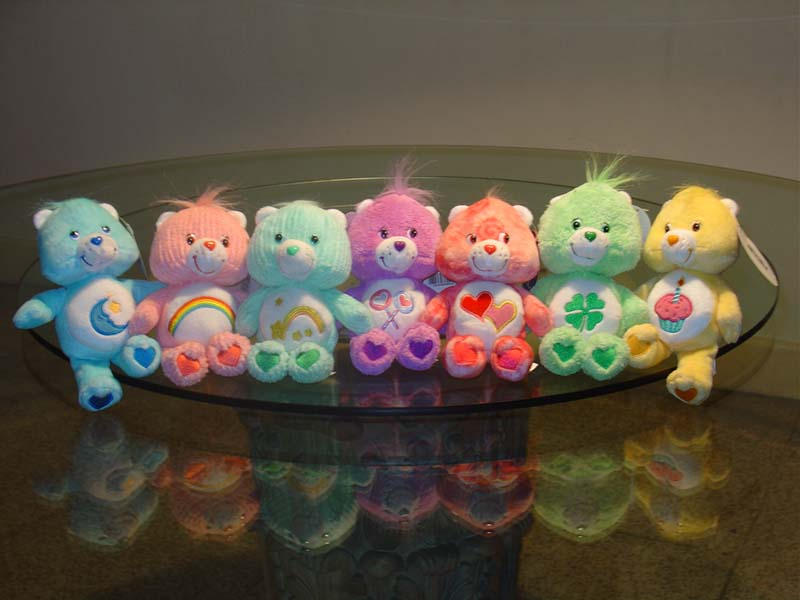
I want to click on pink stuffed bear, so click(205, 219).